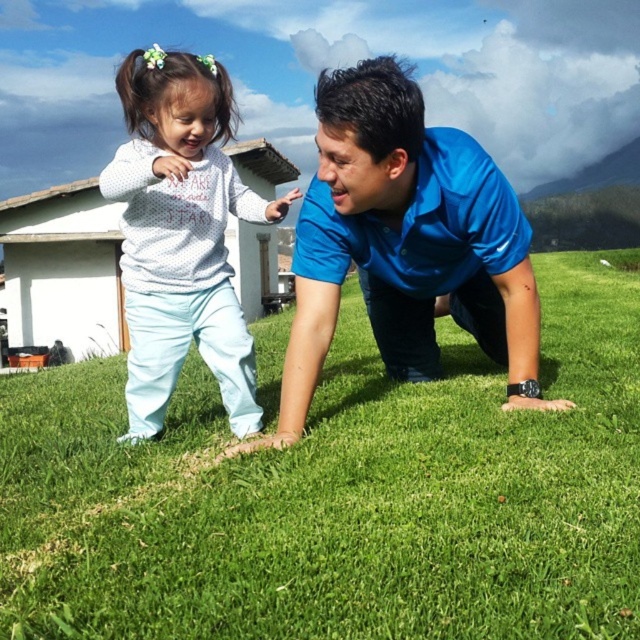
Question: Does blue smooth shirt at center appear under white dotted sweater at upper left?

Choices:
 (A) yes
 (B) no

Answer: (A)

Question: Which of these objects is positioned farthest from the green grass at center?

Choices:
 (A) blue smooth shirt at center
 (B) white dotted sweater at upper left

Answer: (B)

Question: Is the position of green grass at center less distant than that of white dotted sweater at upper left?

Choices:
 (A) yes
 (B) no

Answer: (A)

Question: Is green grass at center to the left of white dotted sweater at upper left from the viewer's perspective?

Choices:
 (A) no
 (B) yes

Answer: (A)

Question: Which point is farther to the camera?

Choices:
 (A) click(x=148, y=145)
 (B) click(x=358, y=442)
 (C) click(x=448, y=140)

Answer: (A)

Question: Which point is farther to the camera?

Choices:
 (A) green grass at center
 (B) blue smooth shirt at center

Answer: (B)